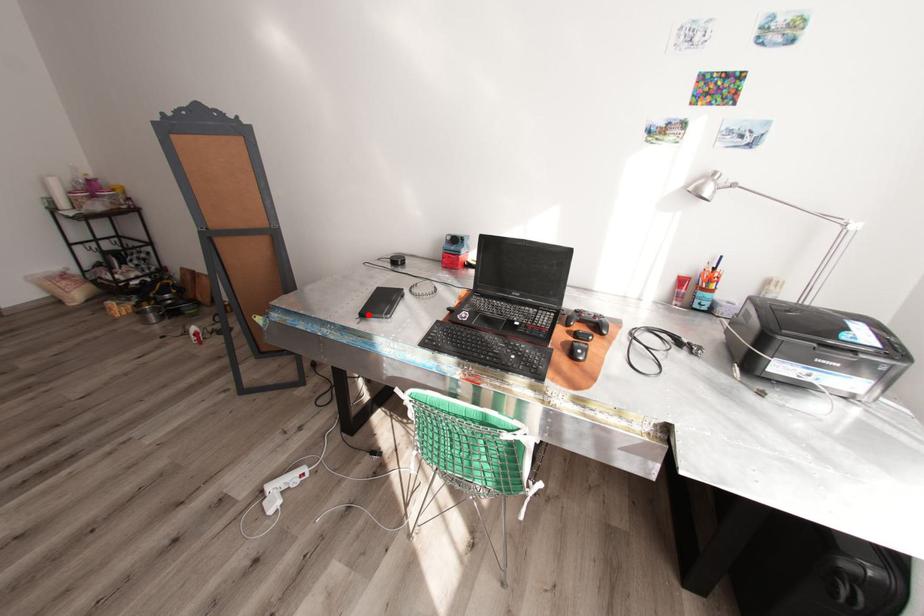
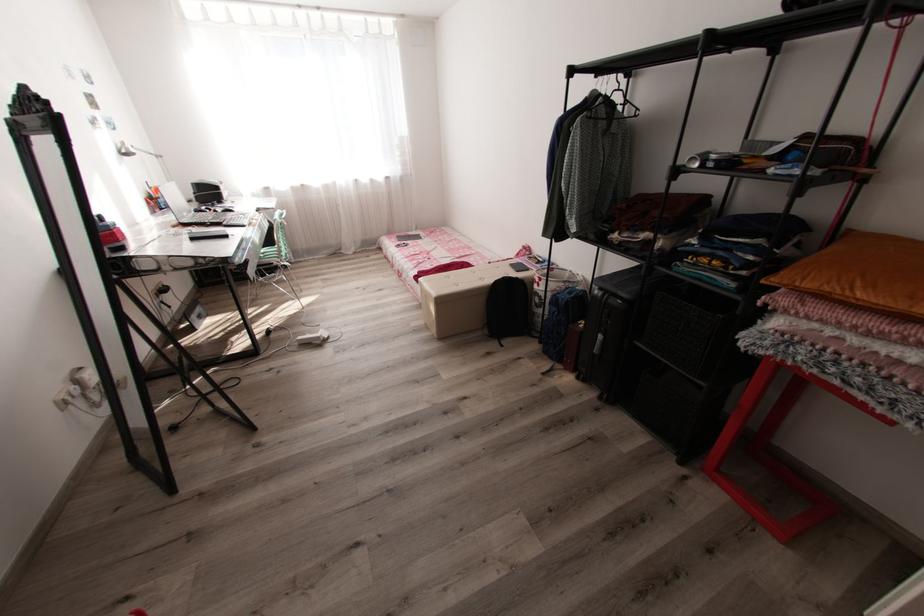
Locate, in the second image, the point that corresponds to the highlighted location in the first image.

(232, 236)